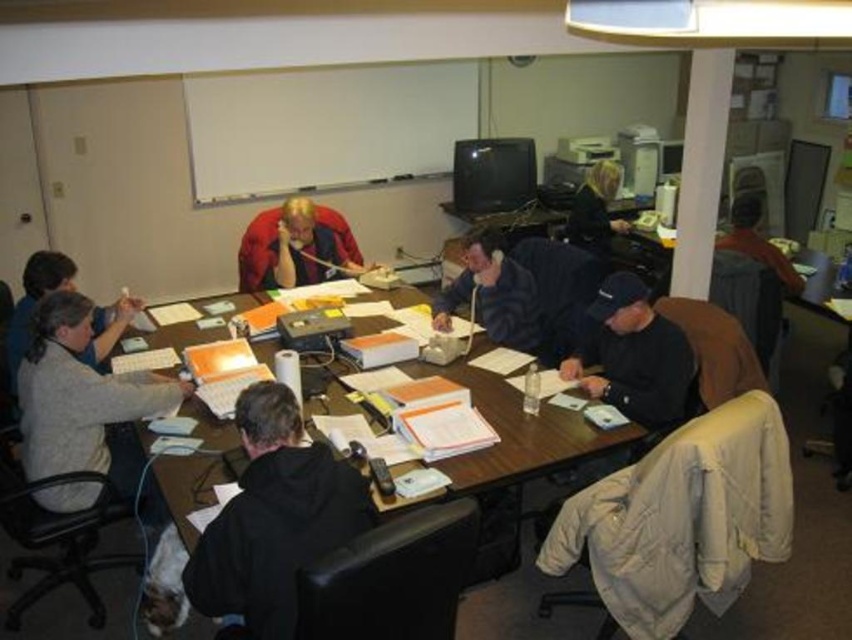
Does matte red jacket at center have a greater height compared to dark gray sweater at center?

No, matte red jacket at center is not taller than dark gray sweater at center.

Between matte red jacket at center and dark gray sweater at center, which one is positioned higher?

matte red jacket at center is above.

Describe the element at coordinates (296, 248) in the screenshot. Image resolution: width=852 pixels, height=640 pixels. I see `matte red jacket at center` at that location.

You are a GUI agent. You are given a task and a screenshot of the screen. Output one action in this format:
    pyautogui.click(x=<x>, y=<y>)
    Task: Click on the matte red jacket at center
    Image resolution: width=852 pixels, height=640 pixels.
    Given the screenshot: What is the action you would take?
    pyautogui.click(x=296, y=248)

Is light gray sweater at left thinner than dark blue hoodie at center?

Incorrect, light gray sweater at left's width is not less than dark blue hoodie at center's.

Which is below, light gray sweater at left or dark blue hoodie at center?

light gray sweater at left is lower down.

Is point (78, 358) positioned behind point (591, 227)?

No, (78, 358) is in front of (591, 227).

What are the coordinates of `light gray sweater at left` in the screenshot? It's located at (85, 404).

Does dark gray sweater at center appear on the right side of dark blue hoodie at center?

In fact, dark gray sweater at center is to the left of dark blue hoodie at center.

Identify the location of dark gray sweater at center. (493, 294).

This screenshot has width=852, height=640. I want to click on dark gray sweater at center, so click(493, 294).